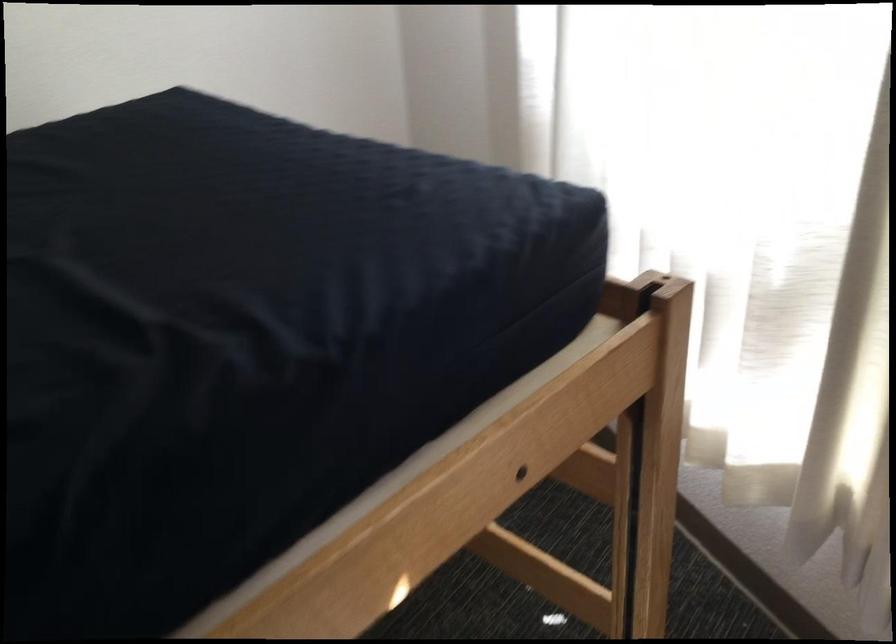
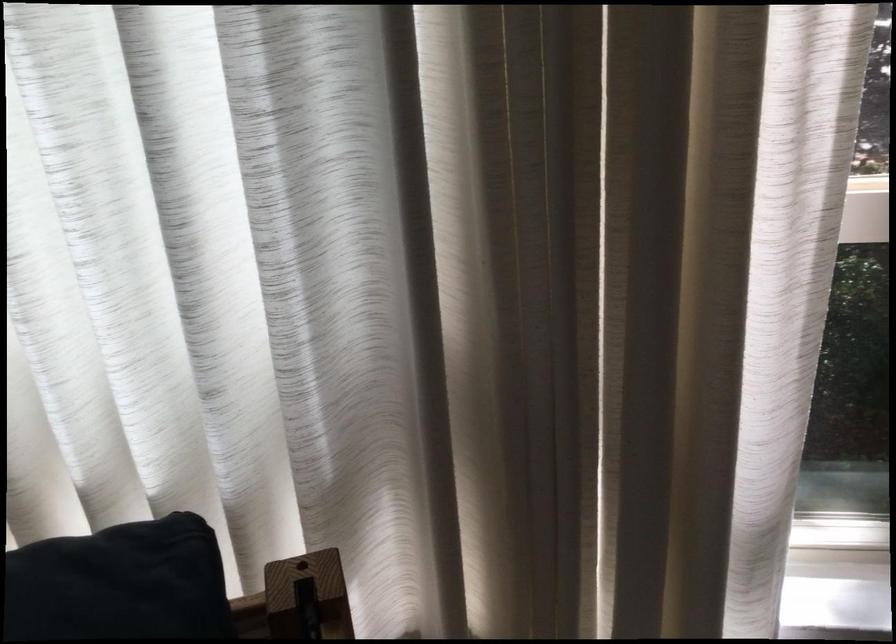
In the second image, find the point that corresponds to point 640,290 in the first image.

(307, 594)